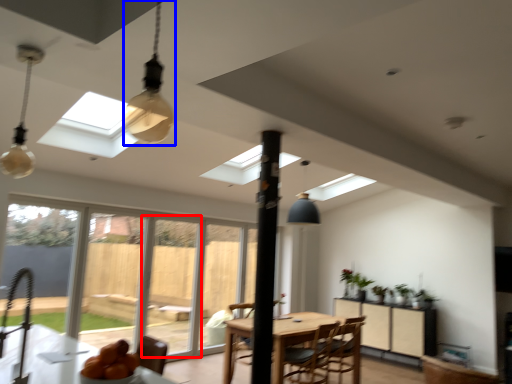
Question: Which of the following is the closest to the observer, screen door (highlighted by a red box) or light fixture (highlighted by a blue box)?

Choices:
 (A) screen door
 (B) light fixture

Answer: (B)